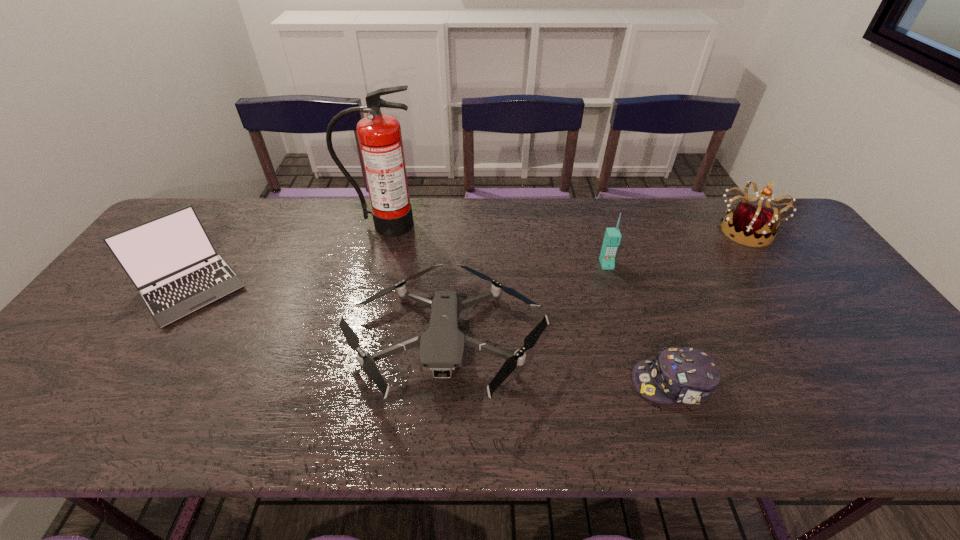
At what (x,y) coordinates should I click in order to perform the action: click on free space between the cellular telephone and the laptop_computer. Please return your answer as a coordinate pair (x, y). Image resolution: width=960 pixels, height=540 pixels. Looking at the image, I should click on (399, 276).

I want to click on vacant point located between the rightmost object and the drone, so coord(595,286).

I want to click on the fourth closest object relative to the cellular telephone, so click(x=380, y=139).

Point out which object is positioned as the second nearest to the leftmost object. Please provide its 2D coordinates. Your answer should be formatted as a tuple, i.e. [(x, y)], where the tuple contains the x and y coordinates of a point satisfying the conditions above.

[(442, 346)]